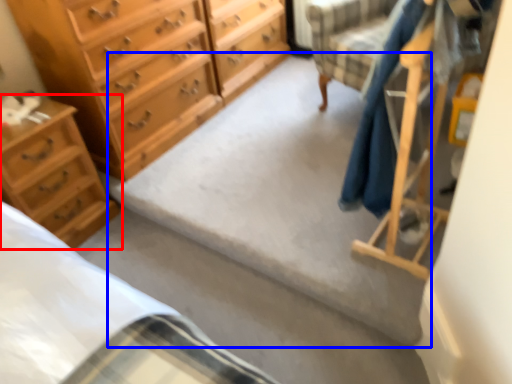
Question: Which point is further to the camera, chest of drawers (highlighted by a red box) or concrete (highlighted by a blue box)?

Choices:
 (A) chest of drawers
 (B) concrete

Answer: (A)